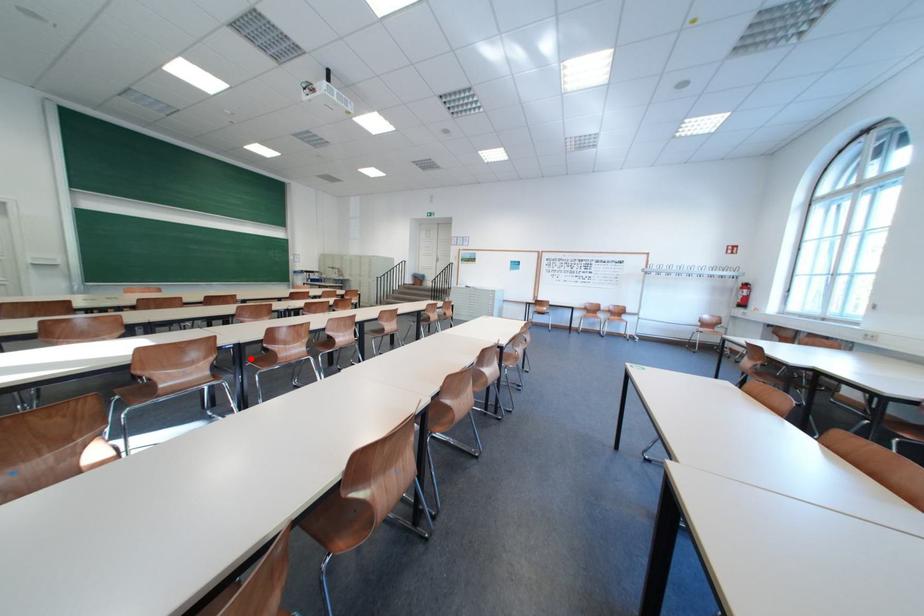
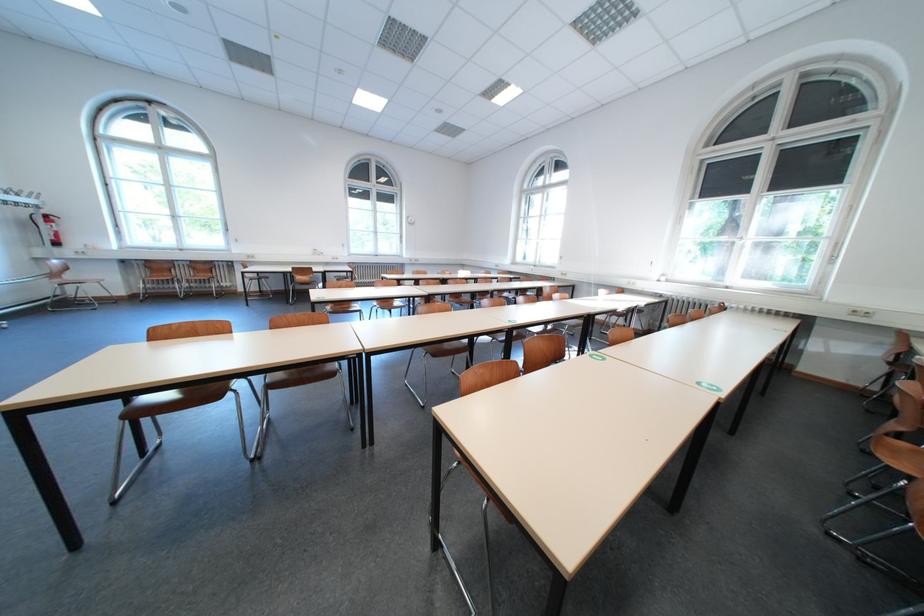
Question: I am providing you with two images of the same scene from different viewpoints. A red point is marked on the first image. At the location where the point appears in image 1, is it still visible in image 2?

Choices:
 (A) Yes
 (B) No

Answer: (B)